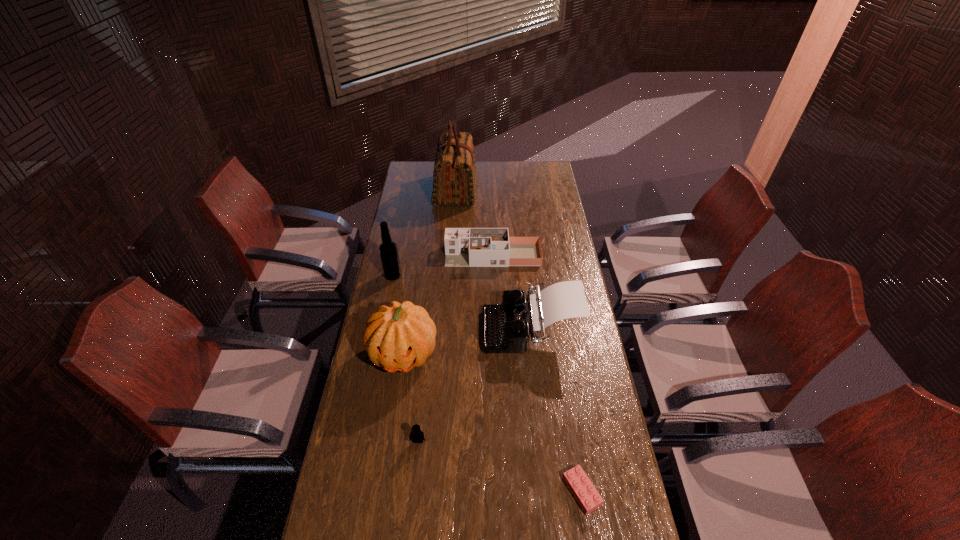
In order to click on vacant region located on the left of the right Lego in this screenshot , I will do `click(468, 491)`.

Locate an element on the screen. The height and width of the screenshot is (540, 960). object present at the far edge is located at coordinates (454, 178).

Identify the location of beer bottle that is at the left edge. (388, 250).

The image size is (960, 540). I want to click on pumpkin that is at the left edge, so click(399, 337).

The height and width of the screenshot is (540, 960). I want to click on typewriter located at the right edge, so click(506, 327).

This screenshot has width=960, height=540. Identify the location of dollhouse that is at the right edge. (464, 247).

This screenshot has height=540, width=960. Find the location of `Lego that is at the right edge`. Lego that is at the right edge is located at coordinates (582, 489).

At what (x,y) coordinates should I click in order to perform the action: click on vacant space at the far edge of the desktop. Please return your answer as a coordinate pair (x, y). The height and width of the screenshot is (540, 960). Looking at the image, I should click on (519, 181).

At what (x,y) coordinates should I click in order to perform the action: click on free location at the left edge of the desktop. Please return your answer as a coordinate pair (x, y). Looking at the image, I should click on (426, 218).

At what (x,y) coordinates should I click in order to perform the action: click on free space at the right edge of the desktop. Please return your answer as a coordinate pair (x, y). This screenshot has width=960, height=540. Looking at the image, I should click on (538, 204).